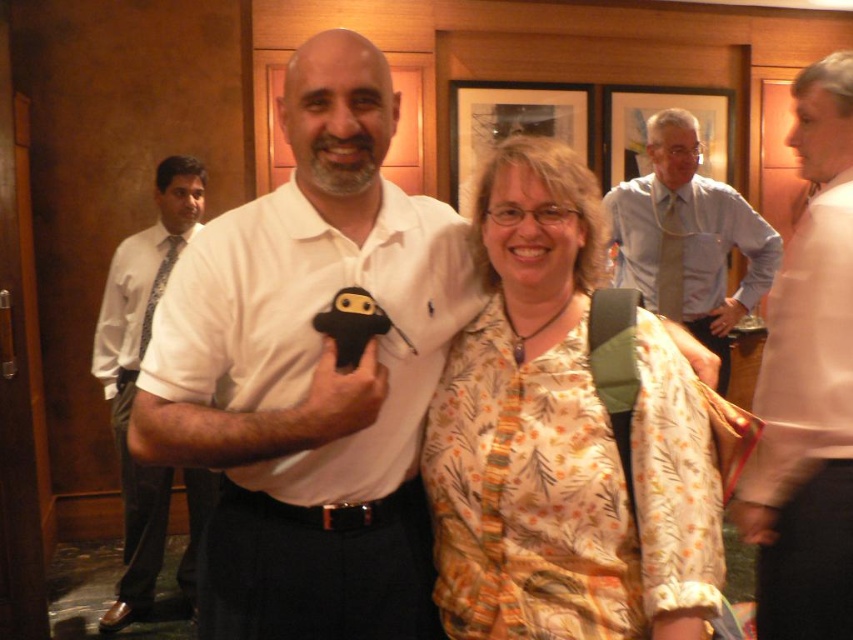
Can you confirm if floral print blouse at center is positioned below white shirt at left?

No, floral print blouse at center is not below white shirt at left.

Measure the distance between floral print blouse at center and camera.

3.85 feet

Locate an element on the screen. The height and width of the screenshot is (640, 853). floral print blouse at center is located at coordinates (564, 436).

Which is above, floral print blouse at center or light blue shirt at upper right?

Positioned higher is light blue shirt at upper right.

Can you confirm if floral print blouse at center is positioned above light blue shirt at upper right?

Incorrect, floral print blouse at center is not positioned above light blue shirt at upper right.

The height and width of the screenshot is (640, 853). Identify the location of floral print blouse at center. (564, 436).

Which is behind, point (712, 580) or point (762, 630)?

Positioned behind is point (762, 630).

Which is more to the right, floral print blouse at center or pink fabric shirt at right?

From the viewer's perspective, pink fabric shirt at right appears more on the right side.

Does point (618, 536) come closer to viewer compared to point (785, 461)?

Yes.

The height and width of the screenshot is (640, 853). What are the coordinates of `floral print blouse at center` in the screenshot? It's located at (564, 436).